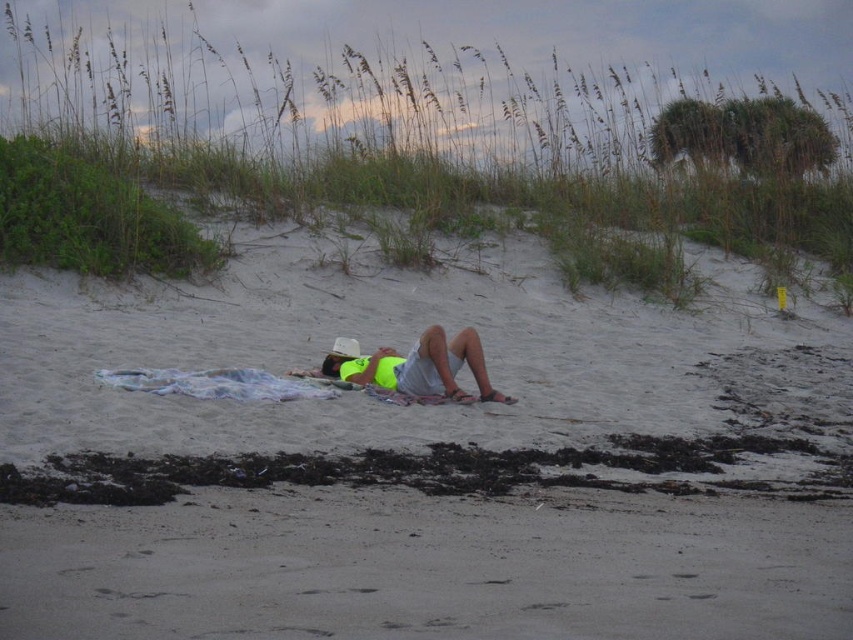
What do you see at coordinates (418, 461) in the screenshot?
I see `white sand at center` at bounding box center [418, 461].

Is white sand at center below neon yellow shirt at center?

Actually, white sand at center is above neon yellow shirt at center.

Identify the location of white sand at center. Image resolution: width=853 pixels, height=640 pixels. (418, 461).

In the scene shown: Between neon yellow shirt at center and white textured towel at center, which one has less height?

white textured towel at center is shorter.

Which is behind, point (471, 368) or point (195, 381)?

The point (471, 368) is more distant.

This screenshot has height=640, width=853. I want to click on neon yellow shirt at center, so click(x=421, y=368).

Which is behind, point (189, 310) or point (206, 397)?

Point (189, 310)

Between point (297, 636) and point (209, 388), which one is positioned in front?

Point (297, 636) is in front.

Locate an element on the screen. This screenshot has height=640, width=853. white sand at center is located at coordinates (418, 461).